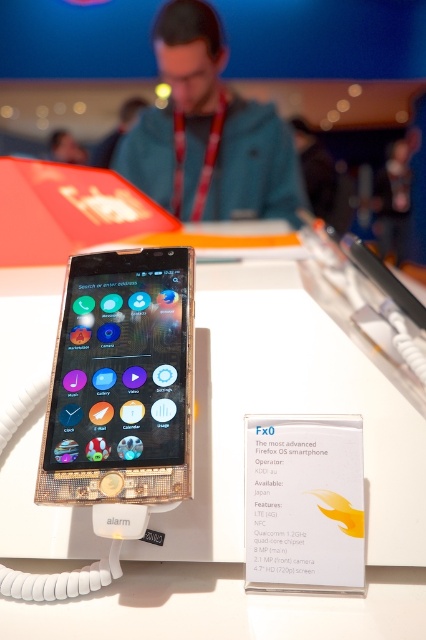
Question: Which point appears closest to the camera in this image?

Choices:
 (A) (176, 314)
 (B) (204, 612)

Answer: (B)

Question: Among these points, which one is farthest from the camera?

Choices:
 (A) (192, 289)
 (B) (170, 100)
 (C) (195, 518)

Answer: (B)

Question: Is white glossy table at center positioned in front of gold textured phone at center?

Choices:
 (A) yes
 (B) no

Answer: (A)

Question: Which is nearer to the gold textured phone at center?

Choices:
 (A) white glossy table at center
 (B) matte blue jacket at upper center

Answer: (A)

Question: Is white glossy table at center to the left of gold textured phone at center from the viewer's perspective?

Choices:
 (A) no
 (B) yes

Answer: (A)

Question: Is white glossy table at center smaller than matte blue jacket at upper center?

Choices:
 (A) no
 (B) yes

Answer: (A)